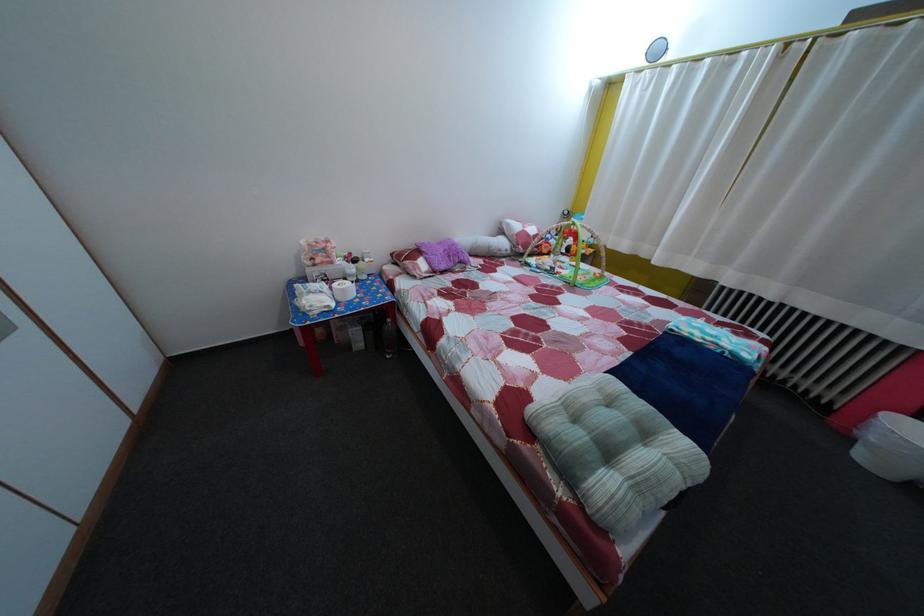
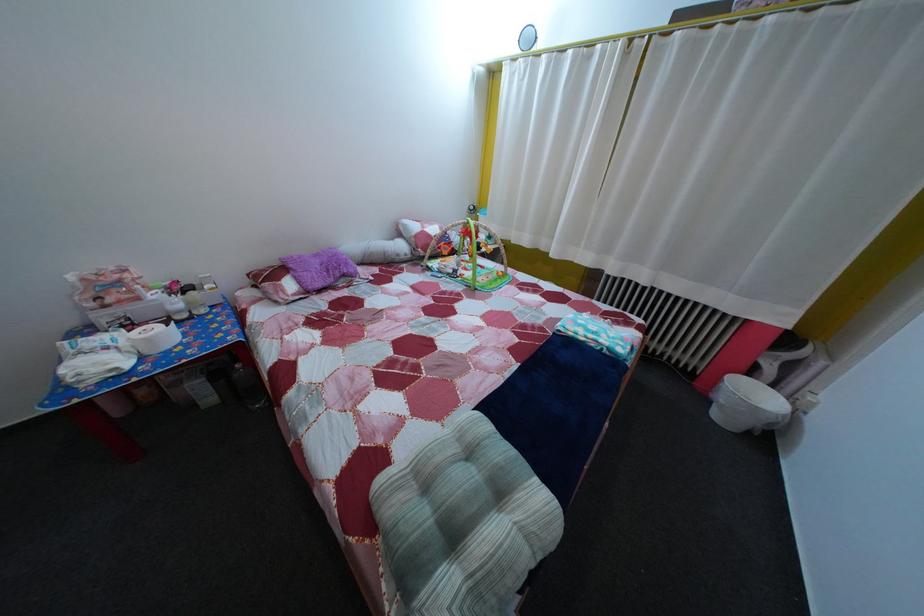
Find the pixel in the second image that matches the point at 353,299 in the first image.

(157, 347)